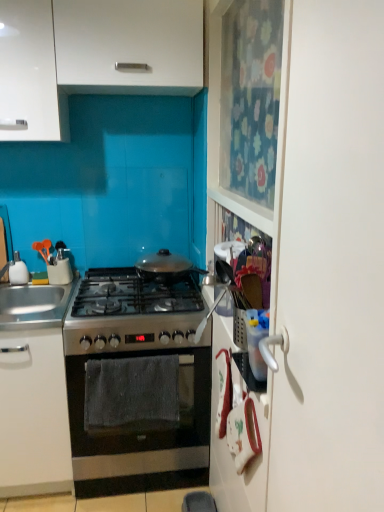
Question: From the image's perspective, is satin silver oven at center, which is counted as the 3th cabinetry, starting from the top, above or below stainless steel oven at center?

Choices:
 (A) below
 (B) above

Answer: (B)

Question: From their relative heights in the image, would you say satin silver oven at center, which is counted as the 3th cabinetry, starting from the top, is taller or shorter than stainless steel oven at center?

Choices:
 (A) short
 (B) tall

Answer: (B)

Question: Which object is positioned farthest from the silver metallic sink at left?

Choices:
 (A) satin silver oven at center, the first cabinetry in the bottom-to-top sequence
 (B) stainless steel gas stove at center
 (C) white glossy cabinet at upper left, which is the 2th cabinetry from bottom to top
 (D) stainless steel oven at center
 (E) white glossy soap dispenser at left

Answer: (C)

Question: Estimate the real-world distances between objects in this image. Which object is farther from the satin silver oven at center, the first cabinetry in the bottom-to-top sequence?

Choices:
 (A) silver metallic sink at left
 (B) stainless steel oven at center
 (C) white glossy soap dispenser at left
 (D) white matte cabinet at upper left, the third cabinetry in the bottom-to-top sequence
 (E) white glossy cabinet at upper left, which is the 2th cabinetry from bottom to top

Answer: (D)